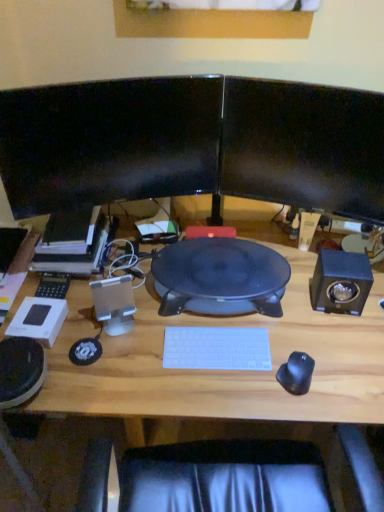
This screenshot has width=384, height=512. What do you see at coordinates (224, 371) in the screenshot? I see `wooden desk at center` at bounding box center [224, 371].

This screenshot has width=384, height=512. What do you see at coordinates (296, 373) in the screenshot?
I see `black rubberized mouse at right` at bounding box center [296, 373].

The width and height of the screenshot is (384, 512). Describe the element at coordinates (217, 348) in the screenshot. I see `white plastic keyboard at center` at that location.

I want to click on white plastic keyboard at center, so click(x=217, y=348).

The width and height of the screenshot is (384, 512). I want to click on wooden desk at center, so click(224, 371).

Is white plastic keyboard at center smaller than black glossy monitor at upper left, acting as the first computer monitor starting from the left?

Yes.

In the scene shown: From the image's perspective, would you say white plastic keyboard at center is positioned over black glossy monitor at upper left, which is the 2th computer monitor in right-to-left order?

Actually, white plastic keyboard at center appears below black glossy monitor at upper left, which is the 2th computer monitor in right-to-left order, in the image.

Is white plastic keyboard at center taller or shorter than black glossy monitor at upper left, which is the 2th computer monitor in right-to-left order?

In the image, white plastic keyboard at center appears to be shorter than black glossy monitor at upper left, which is the 2th computer monitor in right-to-left order.

Locate an element on the screen. This screenshot has width=384, height=512. computer keyboard located underneath the black glossy monitor at upper left, which is the 2th computer monitor in right-to-left order (from a real-world perspective) is located at coordinates (217, 348).

Is silver metallic speaker at left, placed as the 2th speaker when sorted from right to left, positioned with its back to white plastic keyboard at center?

silver metallic speaker at left, placed as the 2th speaker when sorted from right to left, does not have its back to white plastic keyboard at center.

Between silver metallic speaker at left, placed as the 2th speaker when sorted from right to left, and white plastic keyboard at center, which one has smaller width?

silver metallic speaker at left, placed as the 2th speaker when sorted from right to left, is thinner.

Can you confirm if silver metallic speaker at left, marked as the first speaker in a left-to-right arrangement, is smaller than white plastic keyboard at center?

No.

Considering the points (226, 384) and (277, 201), which point is in front, point (226, 384) or point (277, 201)?

The point (226, 384) is in front.

From a real-world perspective, is wooden desk at center below black glossy monitor at upper center, which ranks as the second computer monitor in left-to-right order?

Yes, from a real-world perspective, wooden desk at center is beneath black glossy monitor at upper center, which ranks as the second computer monitor in left-to-right order.

Considering the sizes of objects wooden desk at center and black glossy monitor at upper center, which ranks as the second computer monitor in left-to-right order, in the image provided, who is thinner, wooden desk at center or black glossy monitor at upper center, which ranks as the second computer monitor in left-to-right order,?

Thinner between the two is black glossy monitor at upper center, which ranks as the second computer monitor in left-to-right order.

From the image's perspective, relative to black glossy monitor at upper center, arranged as the first computer monitor when viewed from the right, is wooden desk at center above or below?

A: wooden desk at center is below black glossy monitor at upper center, arranged as the first computer monitor when viewed from the right.

From the image's perspective, is black rubberized mouse at right above or below wooden desk at center?

From the image's perspective, black rubberized mouse at right appears above wooden desk at center.

Is black rubberized mouse at right facing towards wooden desk at center?

No.

Which of these two, black rubberized mouse at right or wooden desk at center, is wider?

With larger width is wooden desk at center.

Who is taller, black rubberized mouse at right or wooden desk at center?

wooden desk at center is taller.

From a real-world perspective, relative to black glossy monitor at upper center, arranged as the first computer monitor when viewed from the right, is silver metallic speaker at left, placed as the 2th speaker when sorted from right to left, vertically above or below?

Clearly, from a real-world perspective, silver metallic speaker at left, placed as the 2th speaker when sorted from right to left, is below black glossy monitor at upper center, arranged as the first computer monitor when viewed from the right.

Considering the positions of point (97, 298) and point (243, 127), is point (97, 298) closer or farther from the camera than point (243, 127)?

Point (97, 298) is closer to the camera than point (243, 127).

Between silver metallic speaker at left, marked as the first speaker in a left-to-right arrangement, and black glossy monitor at upper center, arranged as the first computer monitor when viewed from the right, which one appears on the right side from the viewer's perspective?

black glossy monitor at upper center, arranged as the first computer monitor when viewed from the right.

Is black glossy monitor at upper left, which is the 2th computer monitor in right-to-left order, taller or shorter than white plastic keyboard at center?

Clearly, black glossy monitor at upper left, which is the 2th computer monitor in right-to-left order, is taller compared to white plastic keyboard at center.

Is black glossy monitor at upper left, acting as the first computer monitor starting from the left, not inside white plastic keyboard at center?

Absolutely, black glossy monitor at upper left, acting as the first computer monitor starting from the left, is external to white plastic keyboard at center.

In the scene shown: Is black glossy monitor at upper left, acting as the first computer monitor starting from the left, not near white plastic keyboard at center?

They are positioned close to each other.

Could you tell me if black glossy monitor at upper left, acting as the first computer monitor starting from the left, is turned towards white plastic keyboard at center?

No, black glossy monitor at upper left, acting as the first computer monitor starting from the left, is not aimed at white plastic keyboard at center.

Is wooden desk at center to the right of silver metallic speaker at left, placed as the 2th speaker when sorted from right to left, from the viewer's perspective?

Indeed, wooden desk at center is positioned on the right side of silver metallic speaker at left, placed as the 2th speaker when sorted from right to left.

Does point (150, 373) lie behind point (128, 318)?

No, (150, 373) is in front of (128, 318).

Considering the sizes of objects wooden desk at center and silver metallic speaker at left, placed as the 2th speaker when sorted from right to left, in the image provided, who is smaller, wooden desk at center or silver metallic speaker at left, placed as the 2th speaker when sorted from right to left,?

silver metallic speaker at left, placed as the 2th speaker when sorted from right to left, is smaller.

Who is shorter, wooden desk at center or silver metallic speaker at left, placed as the 2th speaker when sorted from right to left?

silver metallic speaker at left, placed as the 2th speaker when sorted from right to left, is shorter.

Where is `computer keyboard lying on the right of black glossy monitor at upper left, which is the 2th computer monitor in right-to-left order`? This screenshot has width=384, height=512. computer keyboard lying on the right of black glossy monitor at upper left, which is the 2th computer monitor in right-to-left order is located at coordinates (217, 348).

This screenshot has width=384, height=512. In order to click on computer keyboard in front of the silver metallic speaker at left, placed as the 2th speaker when sorted from right to left in this screenshot , I will do `click(217, 348)`.

Looking at the image, which one is located further to silver metallic speaker at left, marked as the first speaker in a left-to-right arrangement, black rubberized mouse at right or black glossy monitor at upper center, arranged as the first computer monitor when viewed from the right?

Among the two, black glossy monitor at upper center, arranged as the first computer monitor when viewed from the right, is located further to silver metallic speaker at left, marked as the first speaker in a left-to-right arrangement.

Estimate the real-world distances between objects in this image. Which object is further from black rubberized mouse at right, white plastic keyboard at center or black glossy monitor at upper left, acting as the first computer monitor starting from the left?

black glossy monitor at upper left, acting as the first computer monitor starting from the left, is further to black rubberized mouse at right.

Based on their spatial positions, is silver metallic speaker at left, marked as the first speaker in a left-to-right arrangement, or black rubberized mouse at right closer to satin black speaker at right, which ranks as the 1th speaker in right-to-left order?

black rubberized mouse at right is positioned closer to the anchor satin black speaker at right, which ranks as the 1th speaker in right-to-left order.

Based on their spatial positions, is white plastic keyboard at center or satin black speaker at right, positioned as the second speaker in left-to-right order, further from black rubberized mouse at right?

Among the two, satin black speaker at right, positioned as the second speaker in left-to-right order, is located further to black rubberized mouse at right.

Considering their positions, is satin black speaker at right, which ranks as the 1th speaker in right-to-left order, positioned further to black glossy monitor at upper left, acting as the first computer monitor starting from the left, than silver metallic speaker at left, placed as the 2th speaker when sorted from right to left?

satin black speaker at right, which ranks as the 1th speaker in right-to-left order.

Looking at this image, based on their spatial positions, is black rubberized mouse at right or black glossy monitor at upper center, arranged as the first computer monitor when viewed from the right, closer to black glossy monitor at upper left, acting as the first computer monitor starting from the left?

Among the two, black glossy monitor at upper center, arranged as the first computer monitor when viewed from the right, is located nearer to black glossy monitor at upper left, acting as the first computer monitor starting from the left.

Looking at the image, which one is located further to satin black speaker at right, which ranks as the 1th speaker in right-to-left order, black glossy monitor at upper center, arranged as the first computer monitor when viewed from the right, or silver metallic speaker at left, marked as the first speaker in a left-to-right arrangement?

Based on the image, silver metallic speaker at left, marked as the first speaker in a left-to-right arrangement, appears to be further to satin black speaker at right, which ranks as the 1th speaker in right-to-left order.

When comparing their distances from satin black speaker at right, positioned as the second speaker in left-to-right order, does black glossy monitor at upper left, acting as the first computer monitor starting from the left, or white plastic keyboard at center seem closer?

white plastic keyboard at center.

Identify the location of computer keyboard located between black glossy monitor at upper left, acting as the first computer monitor starting from the left, and satin black speaker at right, positioned as the second speaker in left-to-right order, in the left-right direction. This screenshot has height=512, width=384. (217, 348).

Locate an element on the screen. computer keyboard between silver metallic speaker at left, marked as the first speaker in a left-to-right arrangement, and satin black speaker at right, which ranks as the 1th speaker in right-to-left order, from left to right is located at coordinates (217, 348).

In order to click on mouse between black glossy monitor at upper center, which ranks as the second computer monitor in left-to-right order, and wooden desk at center vertically in this screenshot , I will do `click(296, 373)`.

The height and width of the screenshot is (512, 384). I want to click on computer monitor between silver metallic speaker at left, placed as the 2th speaker when sorted from right to left, and satin black speaker at right, positioned as the second speaker in left-to-right order, from left to right, so click(304, 147).